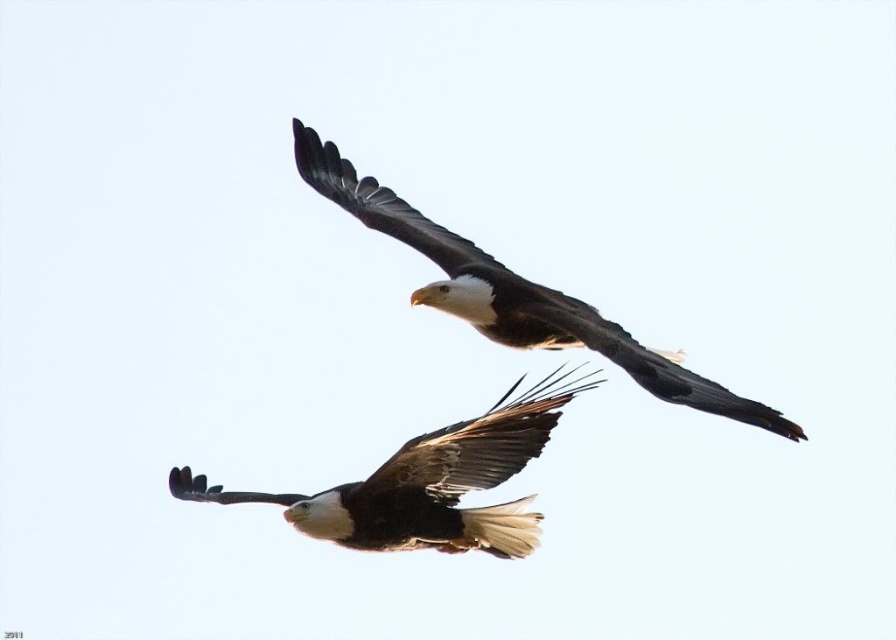
Question: Which object is positioned farthest from the white feathered wing at upper center?

Choices:
 (A) white-brown feathers eagle at lower center
 (B) white-feathered bald eagle at upper center

Answer: (A)

Question: Does white-brown feathers eagle at lower center have a greater width compared to white-feathered bald eagle at upper center?

Choices:
 (A) no
 (B) yes

Answer: (A)

Question: Which of the following is the farthest from the observer?

Choices:
 (A) white-brown feathers eagle at lower center
 (B) white-feathered bald eagle at upper center
 (C) white feathered wing at upper center

Answer: (C)

Question: Based on their relative distances, which object is nearer to the brown feathered wing at center?

Choices:
 (A) white-feathered bald eagle at upper center
 (B) white-brown feathers eagle at lower center

Answer: (B)

Question: Does white-brown feathers eagle at lower center appear on the right side of white-feathered bald eagle at upper center?

Choices:
 (A) no
 (B) yes

Answer: (A)

Question: Is brown feathered wing at center further to camera compared to white feathered wing at upper center?

Choices:
 (A) yes
 (B) no

Answer: (B)